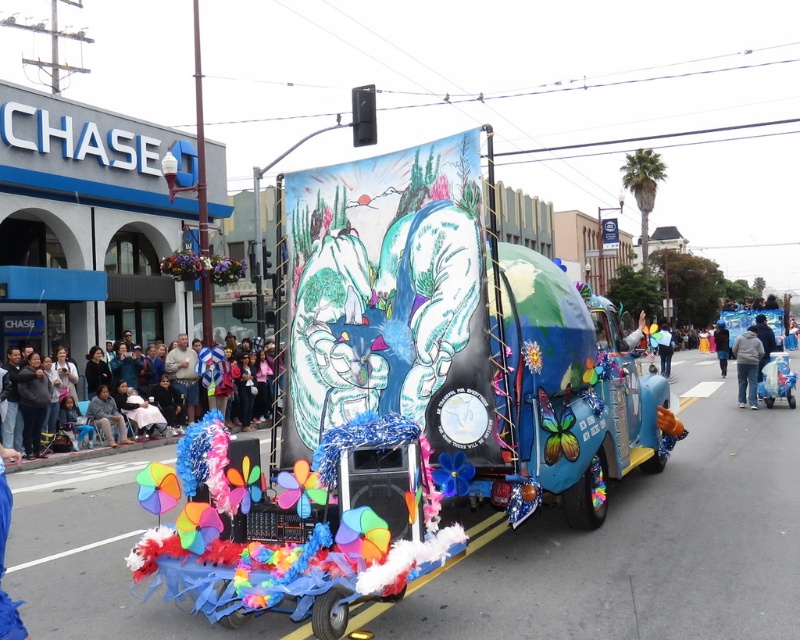
Is blue fabric balloon at center to the left of blue fabric at center from the viewer's perspective?

Indeed, blue fabric balloon at center is positioned on the left side of blue fabric at center.

Can you confirm if blue fabric balloon at center is bigger than blue fabric at center?

Yes.

Is point (658, 330) behind point (724, 337)?

Yes, point (658, 330) is farther from viewer.

Where is `blue fabric balloon at center`? This screenshot has width=800, height=640. blue fabric balloon at center is located at coordinates (664, 348).

Does blue jeans at lower right have a greater height compared to multicolored fabric at lower left?

Yes, blue jeans at lower right is taller than multicolored fabric at lower left.

How distant is blue jeans at lower right from multicolored fabric at lower left?

13.07 meters

Does point (744, 369) lie in front of point (80, 456)?

That is False.

This screenshot has width=800, height=640. Identify the location of blue jeans at lower right. (748, 365).

You are a GUI agent. You are given a task and a screenshot of the screen. Output one action in this format:
    pyautogui.click(x=<x>, y=<y>)
    Task: Click on the multicolored fabric at lower left
    The width and height of the screenshot is (800, 640).
    Given the screenshot: What is the action you would take?
    pyautogui.click(x=97, y=451)

Is point (244, 436) more distant than point (666, 346)?

No, it is in front of (666, 346).

You are a GUI agent. You are given a task and a screenshot of the screen. Output one action in this format:
    pyautogui.click(x=<x>, y=<y>)
    Task: Click on the multicolored fabric at lower left
    The image size is (800, 640).
    Given the screenshot: What is the action you would take?
    pyautogui.click(x=97, y=451)